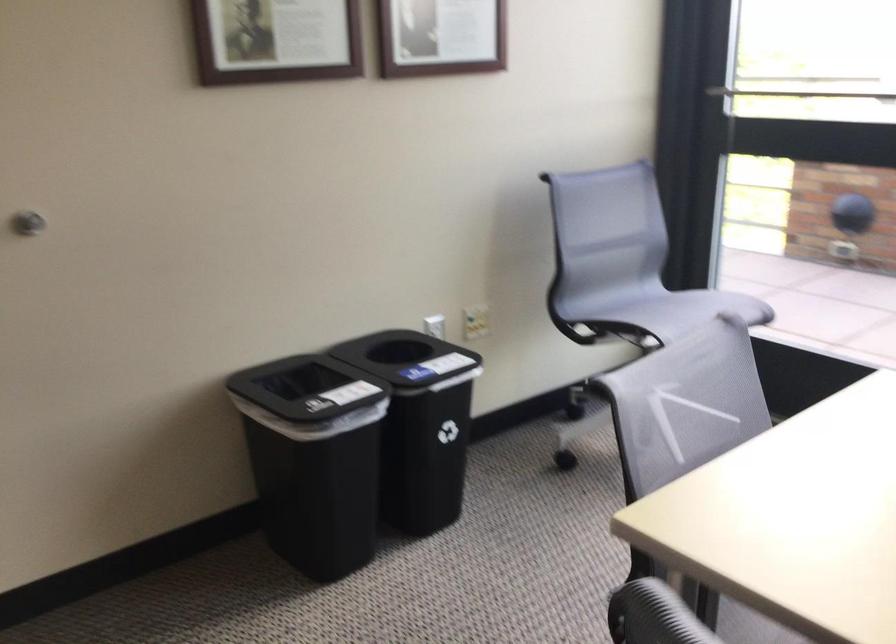
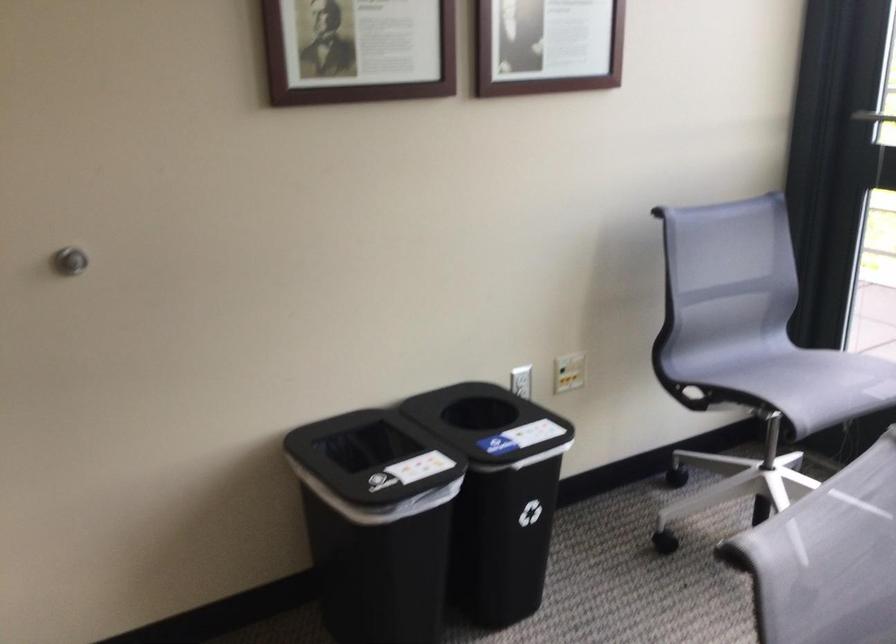
Question: Based on the continuous images, in which direction is the camera rotating? Reply with the corresponding letter.

Choices:
 (A) Left
 (B) Right
 (C) Up
 (D) Down

Answer: (A)